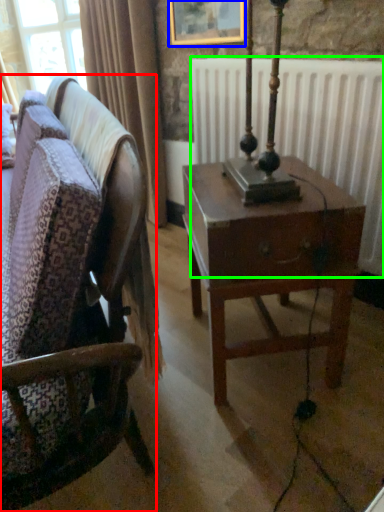
Question: Estimate the real-world distances between objects in this image. Which object is closer to chair (highlighted by a red box), picture frame (highlighted by a blue box) or radiator (highlighted by a green box)?

Choices:
 (A) picture frame
 (B) radiator

Answer: (B)